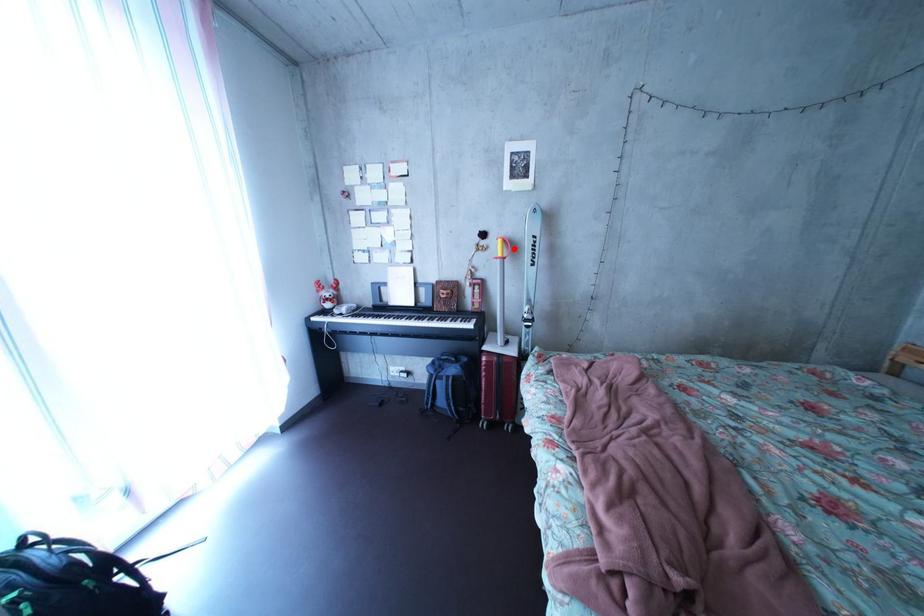
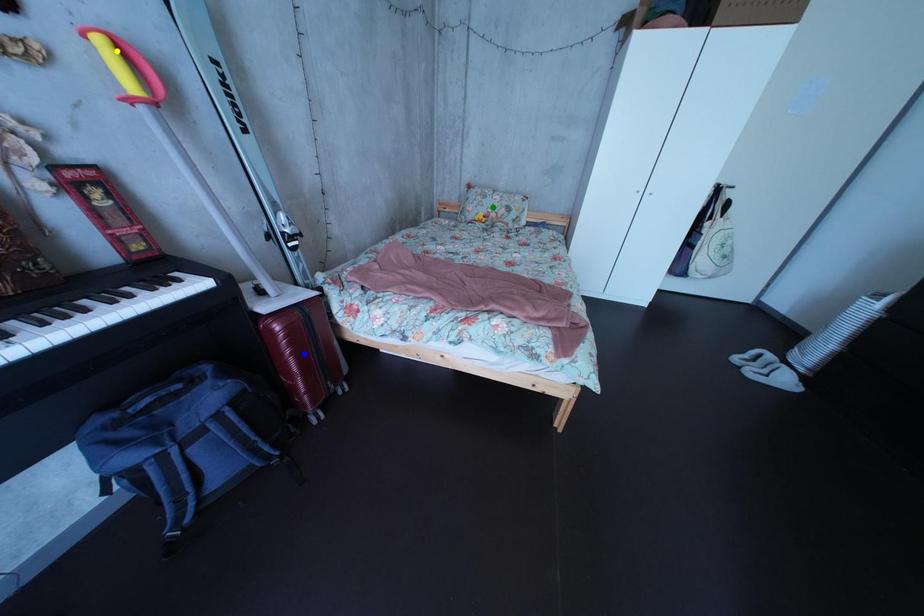
Question: I am providing you with two images of the same scene from different viewpoints. A red point is marked on the first image. You are given multiple points on the second image. Can you choose the point in image 2 that corresponds to the point in image 1?

Choices:
 (A) blue point
 (B) green point
 (C) yellow point

Answer: (C)